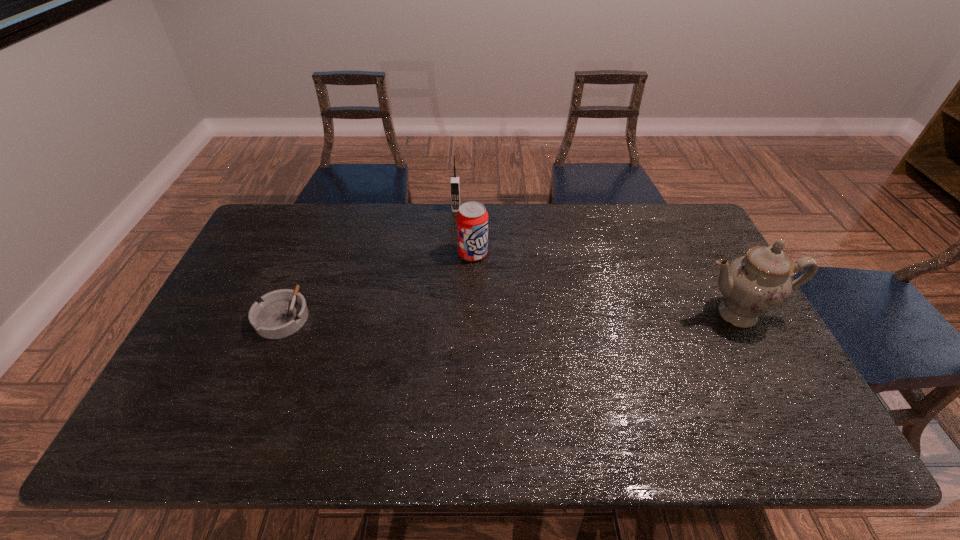
Where is `free spot on the desktop that is between the ashtray and the chinaware and is positioned on the surface of the third object from left to right`? This screenshot has height=540, width=960. free spot on the desktop that is between the ashtray and the chinaware and is positioned on the surface of the third object from left to right is located at coordinates (528, 315).

Identify the location of vacant space on the desktop that is between the shortest object and the tallest object and is positioned on the front-facing side of the cellular telephone. The height and width of the screenshot is (540, 960). (447, 316).